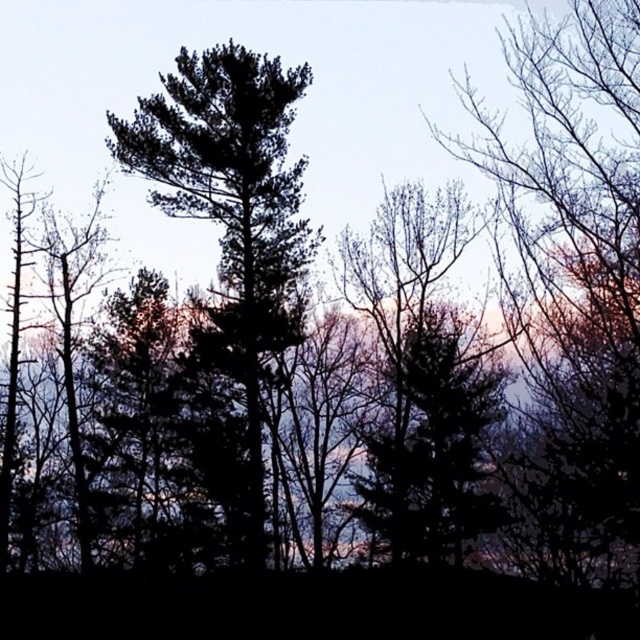
Is point (189, 99) farther from camera compared to point (465, 236)?

No, (189, 99) is closer to viewer.

Is dark green textured tree at center closer to the viewer compared to green leafy tree at center?

No.

This screenshot has height=640, width=640. I want to click on dark green textured tree at center, so click(232, 227).

Can you confirm if silvery bark tree at right is smaller than dark green textured tree at center?

No.

Which is below, silvery bark tree at right or dark green textured tree at center?

silvery bark tree at right

Describe the element at coordinates (573, 276) in the screenshot. I see `silvery bark tree at right` at that location.

Locate an element on the screen. This screenshot has height=640, width=640. silvery bark tree at right is located at coordinates (573, 276).

Which of these two, silvery bark tree at right or green leafy tree at center, stands shorter?

silvery bark tree at right is shorter.

Does silvery bark tree at right have a lesser width compared to green leafy tree at center?

Yes.

Which is in front, point (604, 376) or point (432, 452)?

Point (604, 376) is in front.

Locate an element on the screen. This screenshot has height=640, width=640. silvery bark tree at right is located at coordinates (573, 276).